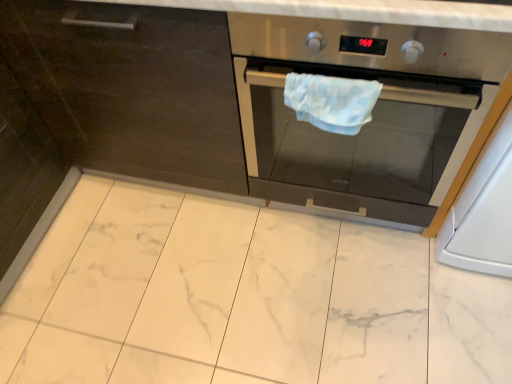
Question: Is white glossy oven at right far away from light blue fabric hand towel at center?

Choices:
 (A) no
 (B) yes

Answer: (A)

Question: Is white glossy oven at right outside light blue fabric hand towel at center?

Choices:
 (A) no
 (B) yes

Answer: (B)

Question: Does white glossy oven at right lie in front of light blue fabric hand towel at center?

Choices:
 (A) yes
 (B) no

Answer: (A)

Question: Considering the relative sizes of white glossy oven at right and light blue fabric hand towel at center in the image provided, is white glossy oven at right bigger than light blue fabric hand towel at center?

Choices:
 (A) yes
 (B) no

Answer: (A)

Question: From the image's perspective, is white glossy oven at right over light blue fabric hand towel at center?

Choices:
 (A) yes
 (B) no

Answer: (B)

Question: Is white glossy oven at right shorter than light blue fabric hand towel at center?

Choices:
 (A) yes
 (B) no

Answer: (B)

Question: Is light blue fabric hand towel at center far from white glossy oven at right?

Choices:
 (A) yes
 (B) no

Answer: (B)

Question: Could you tell me if light blue fabric hand towel at center is facing white glossy oven at right?

Choices:
 (A) yes
 (B) no

Answer: (B)

Question: From the image's perspective, does light blue fabric hand towel at center appear lower than white glossy oven at right?

Choices:
 (A) no
 (B) yes

Answer: (A)

Question: Is light blue fabric hand towel at center further to camera compared to white glossy oven at right?

Choices:
 (A) no
 (B) yes

Answer: (B)

Question: Can you confirm if light blue fabric hand towel at center is positioned to the left of white glossy oven at right?

Choices:
 (A) yes
 (B) no

Answer: (A)

Question: Is light blue fabric hand towel at center smaller than white glossy oven at right?

Choices:
 (A) yes
 (B) no

Answer: (A)

Question: Can you confirm if white glossy oven at right is thinner than stainless steel oven at center?

Choices:
 (A) yes
 (B) no

Answer: (B)